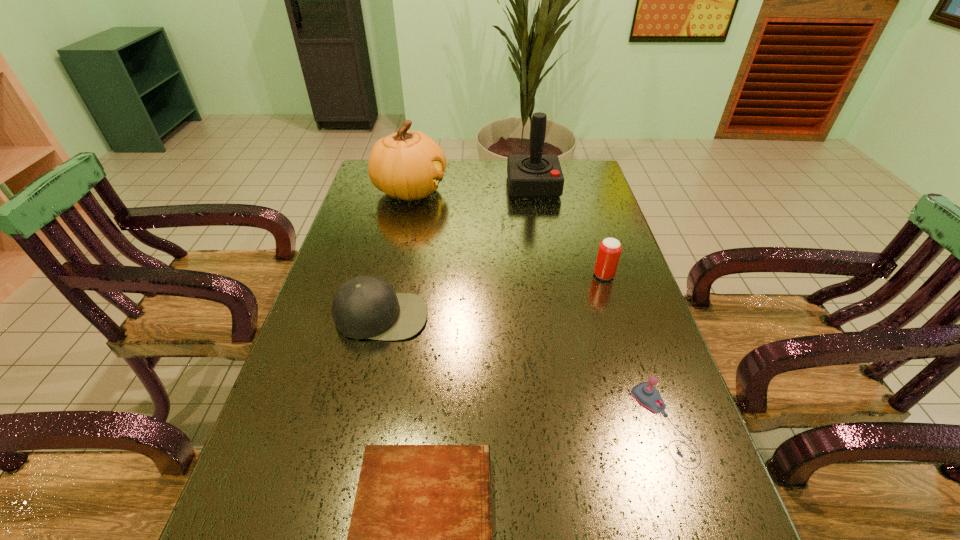
Identify the location of the fourth closest object to the third farthest object. The image size is (960, 540). (409, 165).

The width and height of the screenshot is (960, 540). I want to click on free location that satisfies the following two spatial constraints: 1. on the front face of the pumpkin; 2. on the brim of the fourth farthest object, so click(382, 316).

This screenshot has height=540, width=960. I want to click on free region that satisfies the following two spatial constraints: 1. on the base of the left joystick; 2. on the front face of the pumpkin, so click(534, 191).

You are a GUI agent. You are given a task and a screenshot of the screen. Output one action in this format:
    pyautogui.click(x=<x>, y=<y>)
    Task: Click on the vacant space that satisfies the following two spatial constraints: 1. on the front face of the pumpkin; 2. on the back side of the beer can
    This screenshot has width=960, height=540.
    Given the screenshot: What is the action you would take?
    pyautogui.click(x=392, y=275)

The image size is (960, 540). I want to click on vacant point that satisfies the following two spatial constraints: 1. on the brim of the cap; 2. on the right side of the right joystick, so click(x=357, y=424).

Identify the location of free space that satisfies the following two spatial constraints: 1. on the back side of the beer can; 2. on the front face of the pumpkin. (578, 191).

Find the location of a particular element. The height and width of the screenshot is (540, 960). vacant region that satisfies the following two spatial constraints: 1. on the brim of the fifth tallest object; 2. on the left side of the cap is located at coordinates (357, 424).

Identify the location of vacant space that satisfies the following two spatial constraints: 1. on the base of the farther joystick; 2. on the right side of the beer can. (549, 275).

Find the location of a particular element. vacant region that satisfies the following two spatial constraints: 1. on the front face of the pumpkin; 2. on the brim of the fourth farthest object is located at coordinates 382,316.

I want to click on vacant space that satisfies the following two spatial constraints: 1. on the front face of the pumpkin; 2. on the right side of the beer can, so click(x=392, y=275).